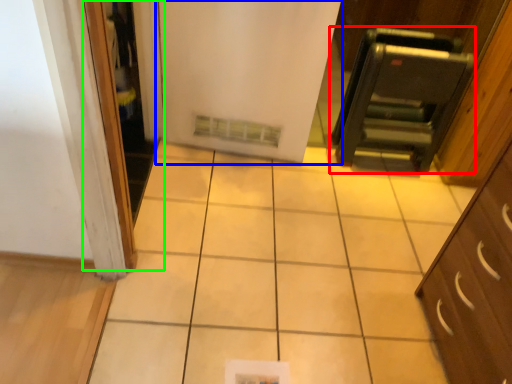
Question: Considering the real-world distances, which object is closest to appliance (highlighted by a red box)? door (highlighted by a blue box) or screen door (highlighted by a green box).

Choices:
 (A) door
 (B) screen door

Answer: (A)